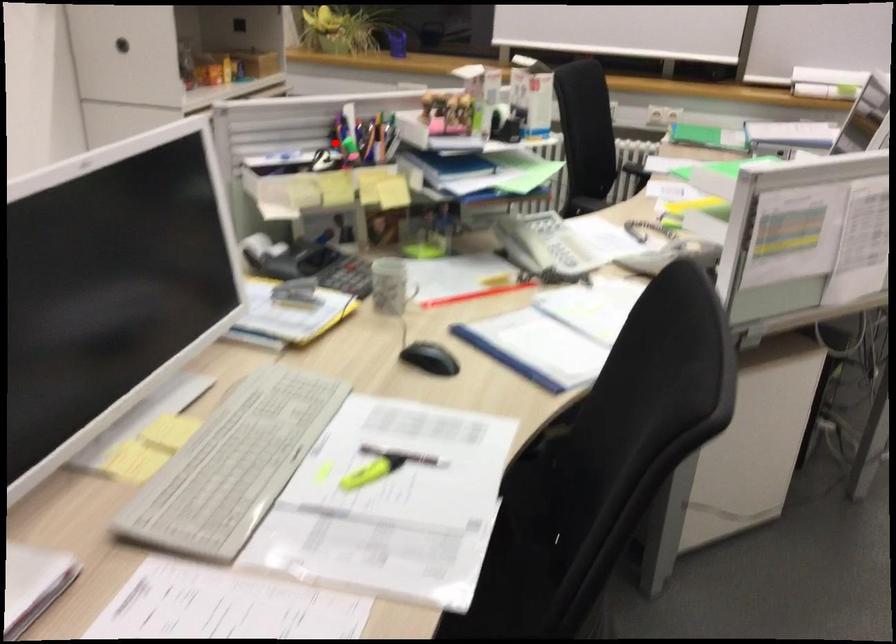
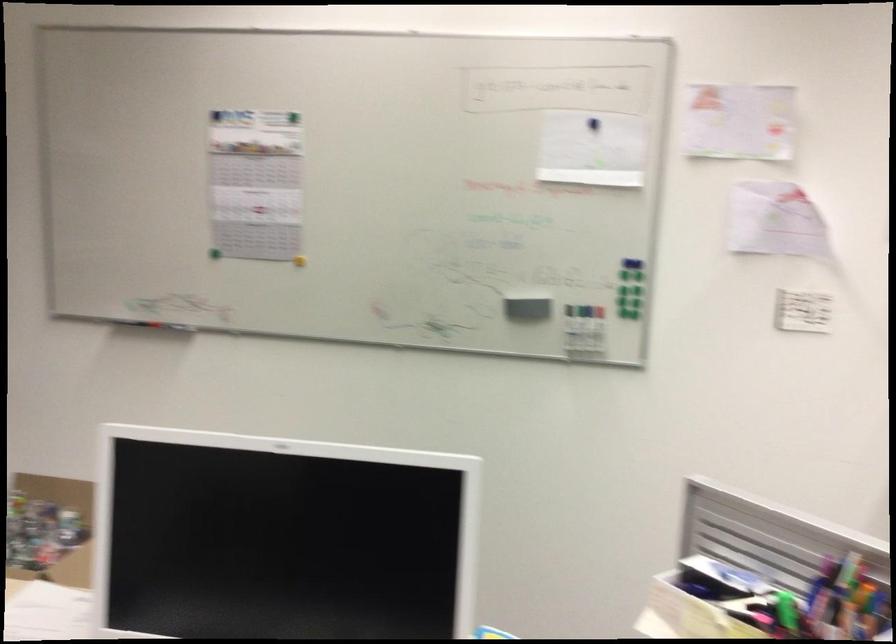
Question: I am providing you with two images of the same scene from different viewpoints. In image1, a red point is highlighted. Considering the same 3D point in image2, which of the following is correct?

Choices:
 (A) It is closer
 (B) It is farther

Answer: (A)